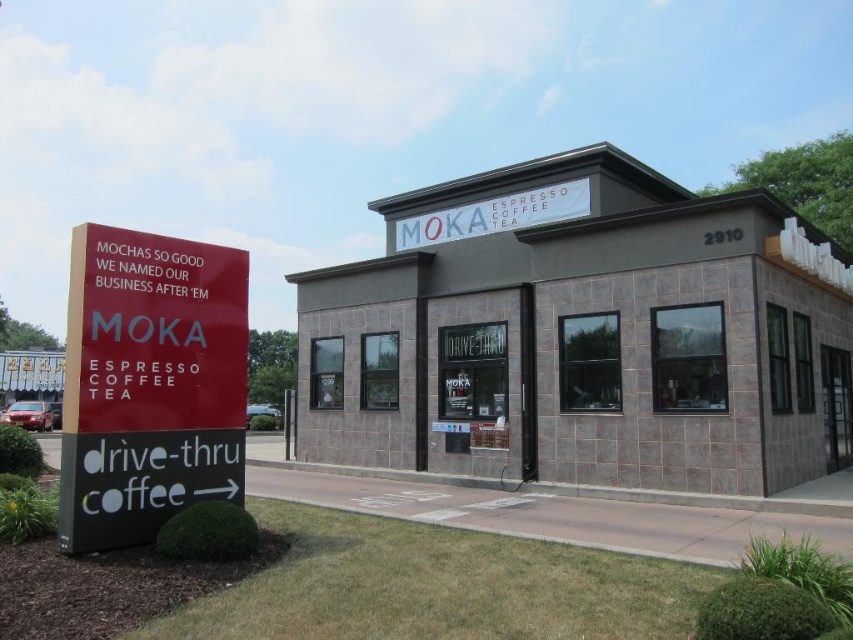
Question: Does gray stone building at center lie behind white fabric sign at upper center?

Choices:
 (A) no
 (B) yes

Answer: (A)

Question: Which point is closer to the camera?

Choices:
 (A) white fabric sign at upper center
 (B) gray stone building at center

Answer: (B)

Question: From the image, what is the correct spatial relationship of gray stone building at center in relation to red matte sign at left?

Choices:
 (A) below
 (B) above

Answer: (B)

Question: Is gray stone building at center behind white fabric sign at upper center?

Choices:
 (A) yes
 (B) no

Answer: (B)

Question: Which object appears closest to the camera in this image?

Choices:
 (A) white fabric sign at upper center
 (B) red matte sign at left
 (C) gray stone building at center

Answer: (B)

Question: Among these objects, which one is farthest from the camera?

Choices:
 (A) red matte sign at left
 (B) gray stone building at center

Answer: (B)